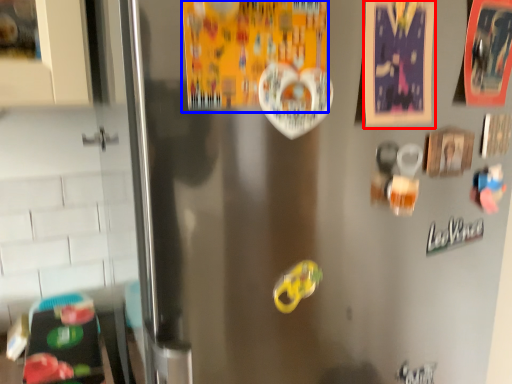
Question: Which object appears farthest to the camera in this image, postcard (highlighted by a red box) or postcard (highlighted by a blue box)?

Choices:
 (A) postcard
 (B) postcard

Answer: (A)